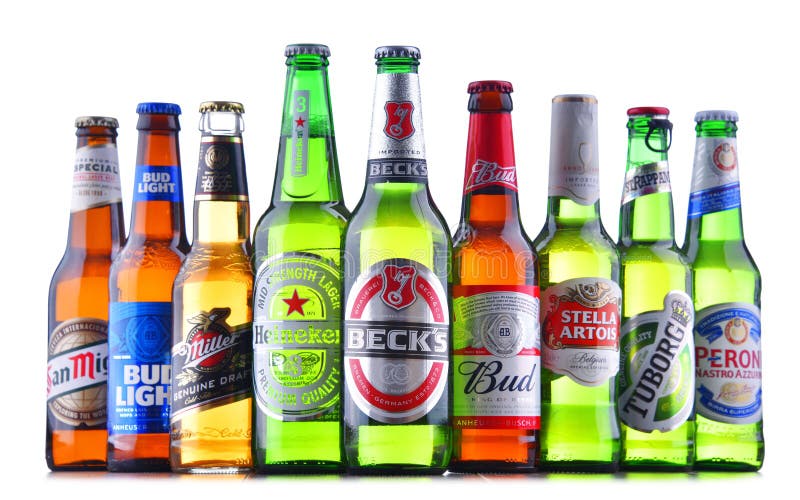
What are the coordinates of `bottles of beer` in the screenshot? It's located at (86, 281), (145, 259), (216, 265), (301, 216), (382, 216), (484, 218), (586, 233), (642, 245), (721, 258).